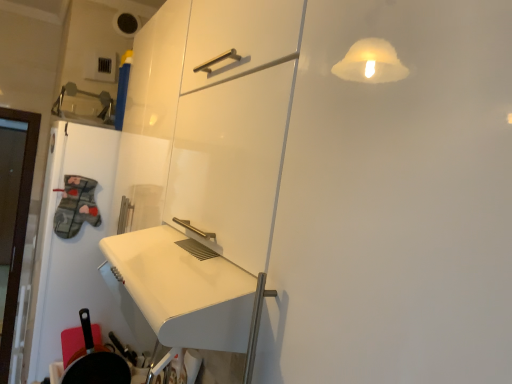
Question: Considering the relative sizes of black matte frying pan at lower left and white glossy door at left in the image provided, is black matte frying pan at lower left smaller than white glossy door at left?

Choices:
 (A) yes
 (B) no

Answer: (A)

Question: Is black matte frying pan at lower left not close to white glossy door at left?

Choices:
 (A) yes
 (B) no

Answer: (B)

Question: Can you confirm if black matte frying pan at lower left is bigger than white glossy door at left?

Choices:
 (A) no
 (B) yes

Answer: (A)

Question: Is black matte frying pan at lower left positioned beyond the bounds of white glossy door at left?

Choices:
 (A) yes
 (B) no

Answer: (A)

Question: Is black matte frying pan at lower left next to white glossy door at left and touching it?

Choices:
 (A) yes
 (B) no

Answer: (B)

Question: Considering the relative positions of black matte frying pan at lower left and white glossy door at left in the image provided, is black matte frying pan at lower left behind white glossy door at left?

Choices:
 (A) no
 (B) yes

Answer: (A)

Question: Does white glossy door at left have a greater width compared to black matte frying pan at lower left?

Choices:
 (A) no
 (B) yes

Answer: (B)

Question: Is white glossy door at left at the left side of black matte frying pan at lower left?

Choices:
 (A) yes
 (B) no

Answer: (A)

Question: Is white glossy door at left surrounding black matte frying pan at lower left?

Choices:
 (A) no
 (B) yes

Answer: (A)

Question: From the image's perspective, is white glossy door at left on black matte frying pan at lower left?

Choices:
 (A) yes
 (B) no

Answer: (A)

Question: Is there a large distance between white glossy door at left and black matte frying pan at lower left?

Choices:
 (A) yes
 (B) no

Answer: (B)

Question: Does white glossy door at left appear on the right side of black matte frying pan at lower left?

Choices:
 (A) yes
 (B) no

Answer: (B)

Question: In terms of size, does black matte frying pan at lower left appear bigger or smaller than white glossy door at left?

Choices:
 (A) big
 (B) small

Answer: (B)